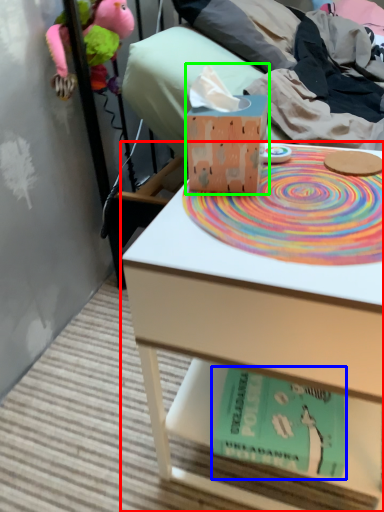
Question: Which is nearer to the table (highlighted by a red box)? paperback book (highlighted by a blue box) or tissue (highlighted by a green box).

Choices:
 (A) paperback book
 (B) tissue

Answer: (A)